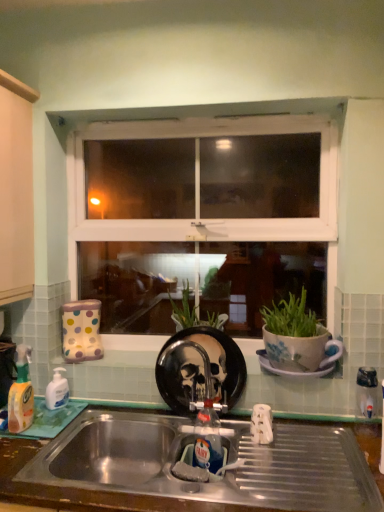
Question: From the image's perspective, does translucent plastic bottle at left, which is the second bottle from back to front, appear higher than white opaque plastic bottle at left, the first bottle when ordered from back to front?

Choices:
 (A) yes
 (B) no

Answer: (A)

Question: Is translucent plastic bottle at left, which is the second bottle from back to front, far away from white opaque plastic bottle at left, the first bottle when ordered from back to front?

Choices:
 (A) yes
 (B) no

Answer: (B)

Question: Is translucent plastic bottle at left, which is the second bottle from back to front, further to the viewer compared to white opaque plastic bottle at left, arranged as the second bottle when viewed from the front?

Choices:
 (A) yes
 (B) no

Answer: (B)

Question: Considering the relative sizes of translucent plastic bottle at left, the first bottle from the front, and white opaque plastic bottle at left, the first bottle when ordered from back to front, in the image provided, is translucent plastic bottle at left, the first bottle from the front, wider than white opaque plastic bottle at left, the first bottle when ordered from back to front,?

Choices:
 (A) yes
 (B) no

Answer: (B)

Question: Does translucent plastic bottle at left, the first bottle from the front, have a larger size compared to white opaque plastic bottle at left, arranged as the second bottle when viewed from the front?

Choices:
 (A) yes
 (B) no

Answer: (A)

Question: From the image's perspective, is translucent plastic bottle at left, which is the second bottle from back to front, positioned above or below white plastic window at center?

Choices:
 (A) below
 (B) above

Answer: (A)

Question: Considering the positions of translucent plastic bottle at left, the first bottle from the front, and white plastic window at center in the image, is translucent plastic bottle at left, the first bottle from the front, bigger or smaller than white plastic window at center?

Choices:
 (A) small
 (B) big

Answer: (A)

Question: In terms of height, does translucent plastic bottle at left, which is the second bottle from back to front, look taller or shorter compared to white plastic window at center?

Choices:
 (A) tall
 (B) short

Answer: (B)

Question: Is translucent plastic bottle at left, the first bottle from the front, to the left or to the right of white plastic window at center in the image?

Choices:
 (A) right
 (B) left

Answer: (B)

Question: Is stainless steel sink at lower center to the left or to the right of white opaque plastic bottle at left, the first bottle when ordered from back to front, in the image?

Choices:
 (A) right
 (B) left

Answer: (A)

Question: Is stainless steel sink at lower center wider or thinner than white opaque plastic bottle at left, the first bottle when ordered from back to front?

Choices:
 (A) wide
 (B) thin

Answer: (A)

Question: In terms of height, does stainless steel sink at lower center look taller or shorter compared to white opaque plastic bottle at left, arranged as the second bottle when viewed from the front?

Choices:
 (A) short
 (B) tall

Answer: (A)

Question: Is stainless steel sink at lower center bigger or smaller than white opaque plastic bottle at left, arranged as the second bottle when viewed from the front?

Choices:
 (A) big
 (B) small

Answer: (A)

Question: From the image's perspective, is white ceramic saucer at center above or below stainless steel sink at lower center?

Choices:
 (A) above
 (B) below

Answer: (A)

Question: From a real-world perspective, is white ceramic saucer at center above or below stainless steel sink at lower center?

Choices:
 (A) above
 (B) below

Answer: (A)